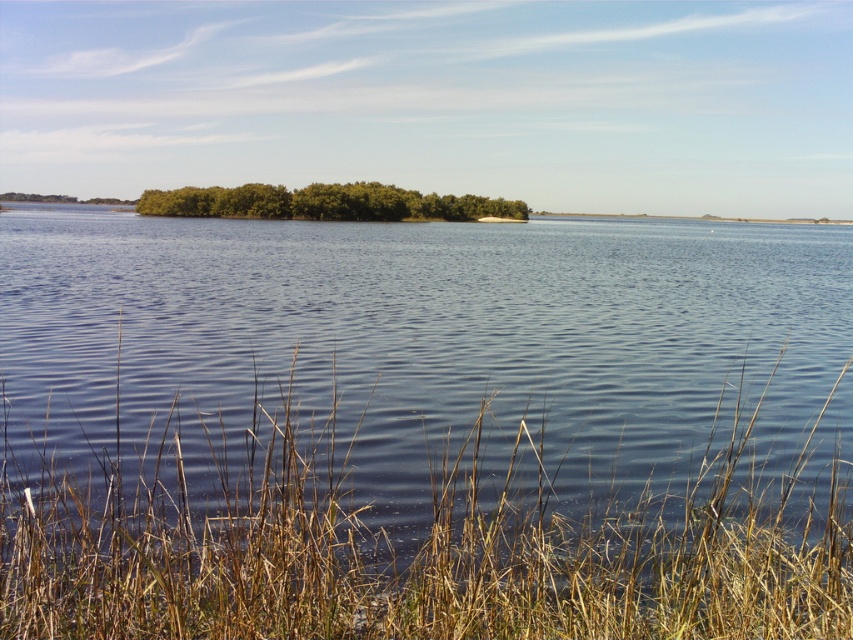
Question: Which of the following is the closest to the observer?

Choices:
 (A) (160, 212)
 (B) (252, 502)

Answer: (B)

Question: Considering the relative positions of dry grass at lower center and green leafy trees at center in the image provided, where is dry grass at lower center located with respect to green leafy trees at center?

Choices:
 (A) right
 (B) left

Answer: (A)

Question: Which point is farther to the camera?

Choices:
 (A) dry grass at lower center
 (B) green leafy trees at center

Answer: (B)

Question: Can you confirm if dry grass at lower center is smaller than green leafy trees at center?

Choices:
 (A) no
 (B) yes

Answer: (B)

Question: Can you confirm if dry grass at lower center is positioned above green leafy trees at center?

Choices:
 (A) no
 (B) yes

Answer: (A)